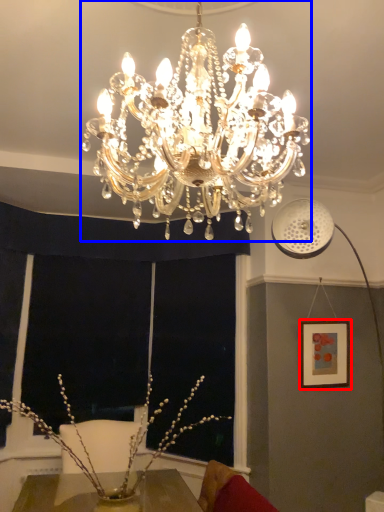
Question: Among these objects, which one is farthest to the camera, picture frame (highlighted by a red box) or lamp (highlighted by a blue box)?

Choices:
 (A) picture frame
 (B) lamp

Answer: (A)